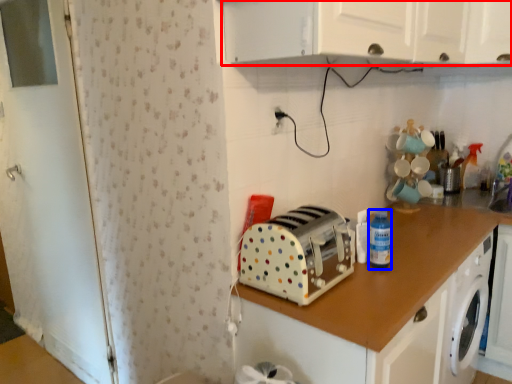
Question: Which point is further to the camera, cabinetry (highlighted by a red box) or bottle (highlighted by a blue box)?

Choices:
 (A) cabinetry
 (B) bottle

Answer: (B)